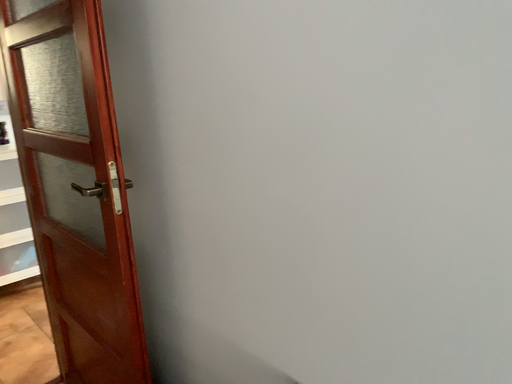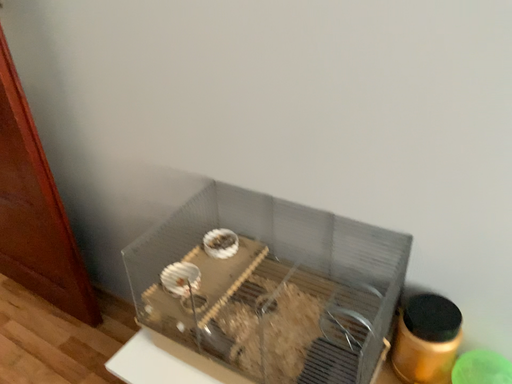
Question: How did the camera likely rotate when shooting the video?

Choices:
 (A) rotated left
 (B) rotated right

Answer: (B)